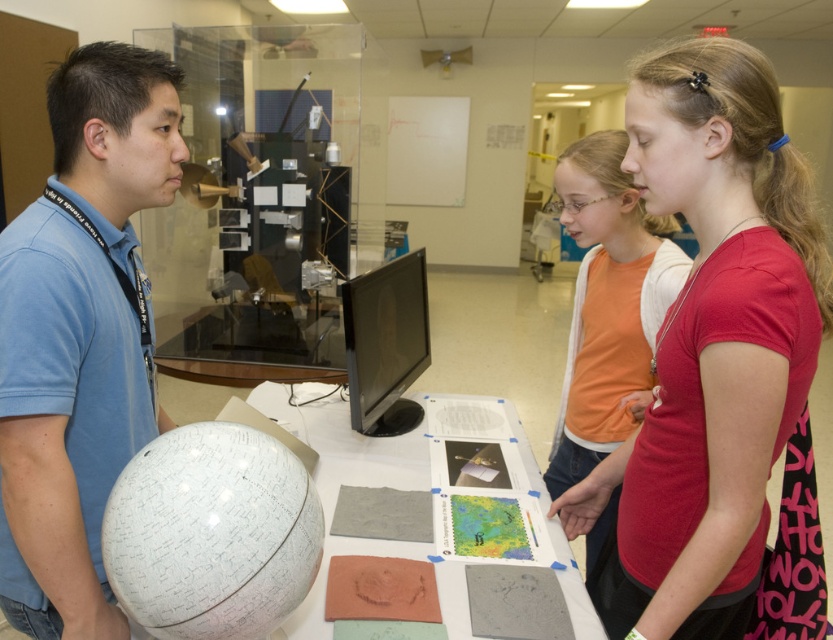
Question: Among these objects, which one is farthest from the camera?

Choices:
 (A) matte red shirt at center
 (B) white matte globe at left

Answer: (B)

Question: Does white matte globe at left appear over matte orange shirt at center?

Choices:
 (A) yes
 (B) no

Answer: (A)

Question: Which point is closer to the camera?

Choices:
 (A) (589, 456)
 (B) (48, 211)
 (C) (719, 314)

Answer: (C)

Question: Can you confirm if matte red shirt at center is bigger than white matte globe at left?

Choices:
 (A) no
 (B) yes

Answer: (B)

Question: Does matte red shirt at center appear over white matte globe at left?

Choices:
 (A) no
 (B) yes

Answer: (A)

Question: Which point is farther from the camera taking this photo?

Choices:
 (A) click(x=656, y=131)
 (B) click(x=600, y=525)
 (C) click(x=7, y=486)

Answer: (B)